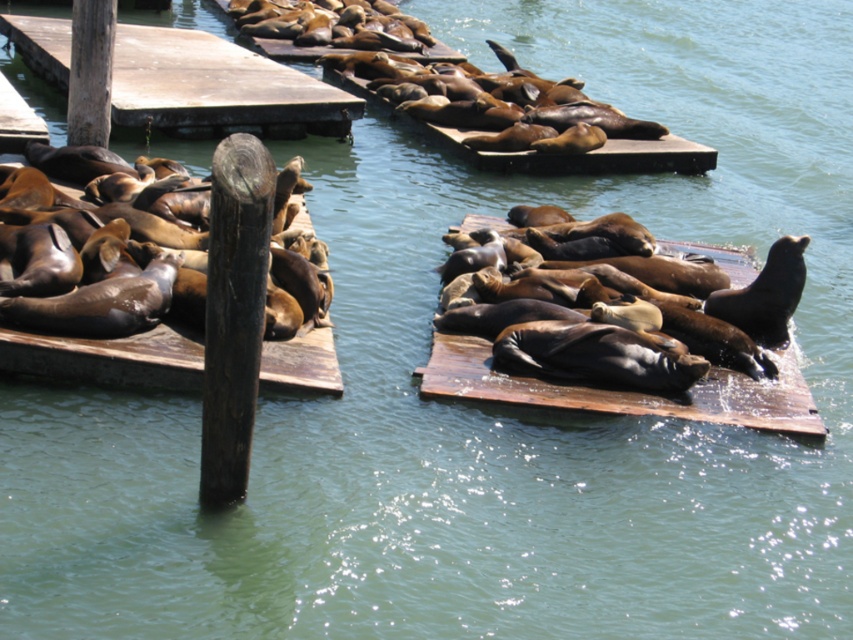
Question: Is wooden dock at upper left bigger than brown wooden dock at left?

Choices:
 (A) yes
 (B) no

Answer: (A)

Question: Is wooden dock at upper left thinner than brown wooden dock at center?

Choices:
 (A) yes
 (B) no

Answer: (B)

Question: Which point is farther to the camera?

Choices:
 (A) (30, 22)
 (B) (338, 385)

Answer: (A)

Question: Which is farther from the brown wooden dock at center?

Choices:
 (A) wooden dock at upper left
 (B) brown wooden dock at left

Answer: (A)

Question: Can you confirm if wooden dock at upper left is wider than brown wooden dock at center?

Choices:
 (A) yes
 (B) no

Answer: (A)

Question: Which is nearer to the brown wooden dock at center?

Choices:
 (A) wooden dock at upper left
 (B) brown wooden dock at left

Answer: (B)